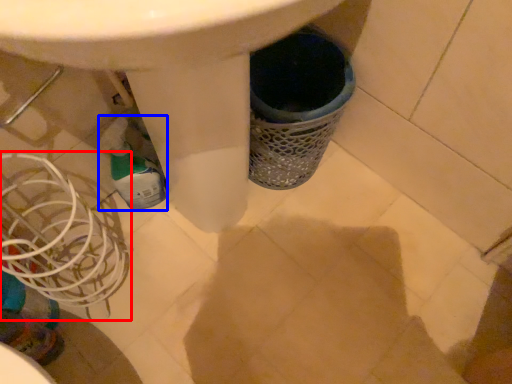
Question: Among these objects, which one is nearest to the camera, basket (highlighted by a red box) or bottle (highlighted by a blue box)?

Choices:
 (A) basket
 (B) bottle

Answer: (A)